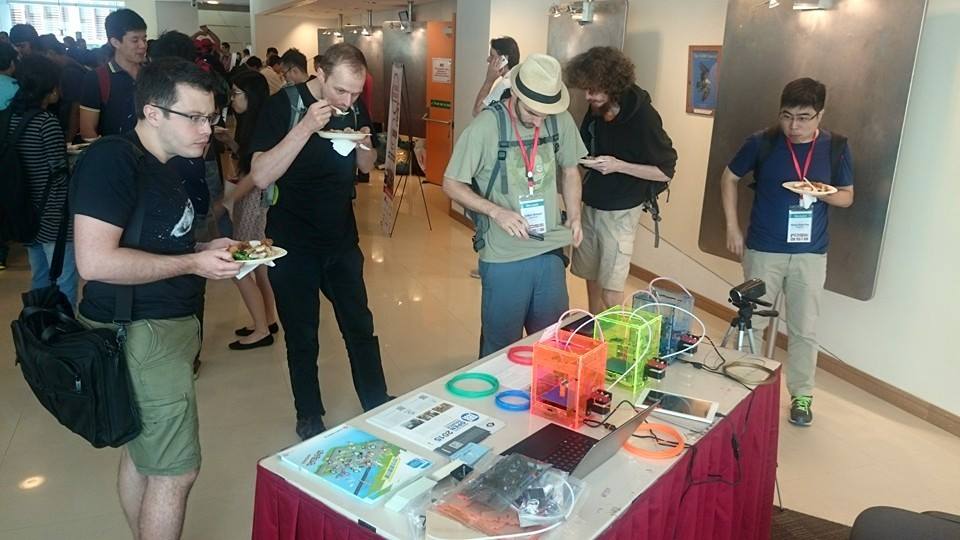
Locate an element on the screen. The height and width of the screenshot is (540, 960). white background wall is located at coordinates coord(903,336), coord(946,131), coord(678,210), coord(645,14), coord(506,18), coord(275,25), coord(168,18).